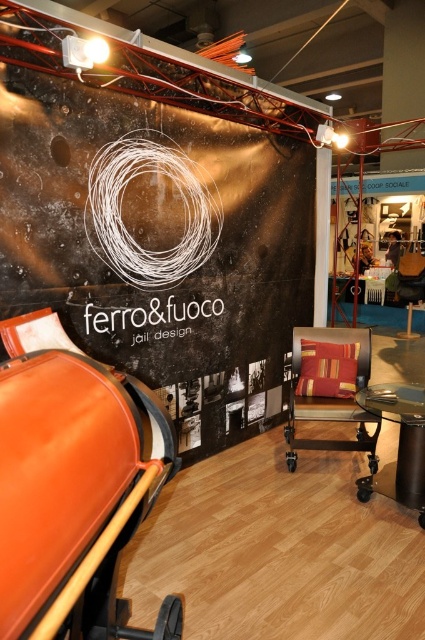
Question: Which point is farther from the camera taking this photo?

Choices:
 (A) (155, 358)
 (B) (405, 435)

Answer: (A)

Question: Does metallic wall at center appear over textured beige swivel chair at center?

Choices:
 (A) yes
 (B) no

Answer: (A)

Question: Which object is closer to the camera taking this photo?

Choices:
 (A) metallic wall at center
 (B) metallic glass table at lower right

Answer: (A)

Question: Is metallic wall at center in front of textured beige swivel chair at center?

Choices:
 (A) no
 (B) yes

Answer: (B)

Question: Which object appears closest to the camera in this image?

Choices:
 (A) metallic wall at center
 (B) metallic glass table at lower right

Answer: (A)

Question: Observing the image, what is the correct spatial positioning of textured beige swivel chair at center in reference to metallic glass table at lower right?

Choices:
 (A) left
 (B) right

Answer: (A)